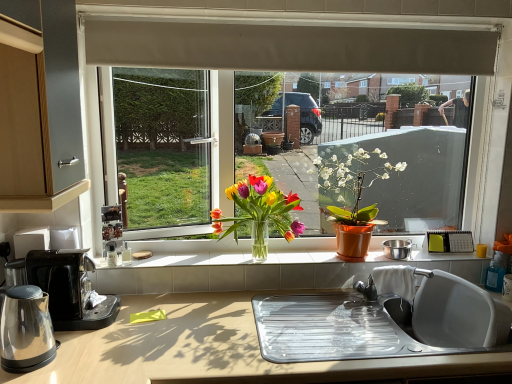
This screenshot has width=512, height=384. Find the location of `blank space above black plastic coffee maker at lower left (from a real-world perspective)`. blank space above black plastic coffee maker at lower left (from a real-world perspective) is located at coordinates (44, 253).